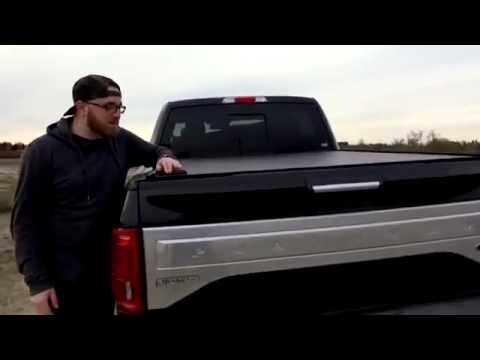
The width and height of the screenshot is (480, 360). I want to click on cab light, so click(x=245, y=100).